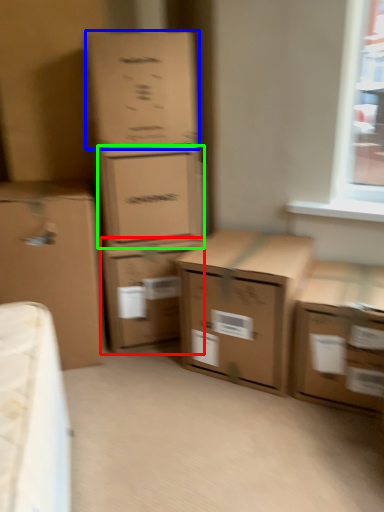
Question: Considering the real-world distances, which object is farthest from box (highlighted by a red box)? box (highlighted by a blue box) or box (highlighted by a green box)?

Choices:
 (A) box
 (B) box

Answer: (A)